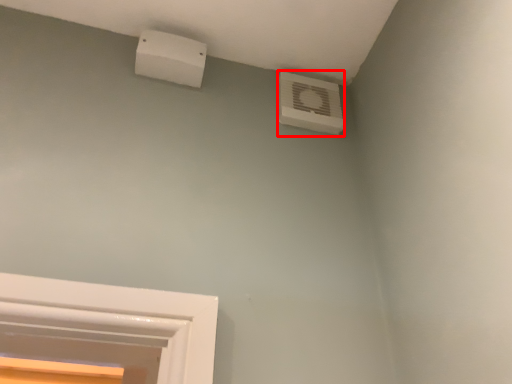
Question: In this image, where is air conditioning (annotated by the red box) located relative to air conditioning?

Choices:
 (A) left
 (B) right

Answer: (B)